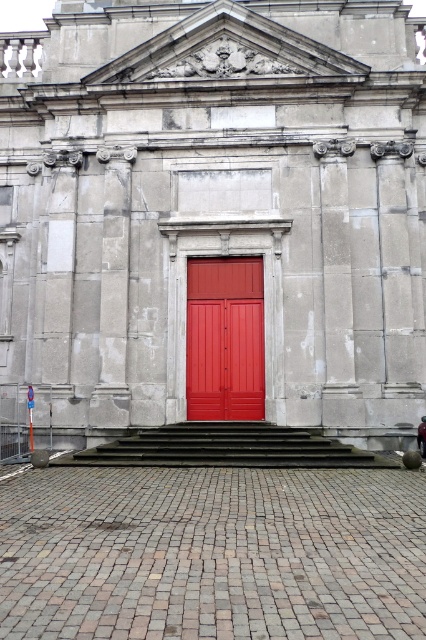
The width and height of the screenshot is (426, 640). Describe the element at coordinates (215, 218) in the screenshot. I see `smooth red door at center` at that location.

The image size is (426, 640). In order to click on smooth red door at center in this screenshot , I will do `click(215, 218)`.

Who is positioned more to the left, smooth red door at center or matte red door at center?

smooth red door at center

Does smooth red door at center have a greater width compared to matte red door at center?

Yes, smooth red door at center is wider than matte red door at center.

Does point (258, 74) lie behind point (227, 364)?

Yes, it is behind point (227, 364).

Find the location of a particular element. smooth red door at center is located at coordinates (215, 218).

Is point (204, 404) closer to viewer compared to point (278, 444)?

No, it is behind (278, 444).

Is matte red door at center taller than smooth concrete stairs at center?

Indeed, matte red door at center has a greater height compared to smooth concrete stairs at center.

Is point (207, 324) positioned in front of point (360, 451)?

No, it is behind (360, 451).

The height and width of the screenshot is (640, 426). I want to click on matte red door at center, so click(224, 339).